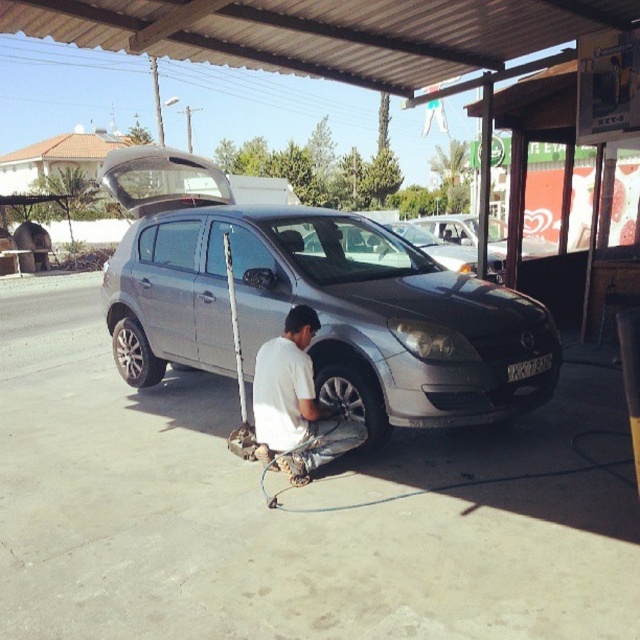
You are standing at the roadside service area and see the satin silver car at center and the silver metallic tire at lower left. Which object is nearer to you?

The satin silver car at center is closer to the viewer than the silver metallic tire at lower left.